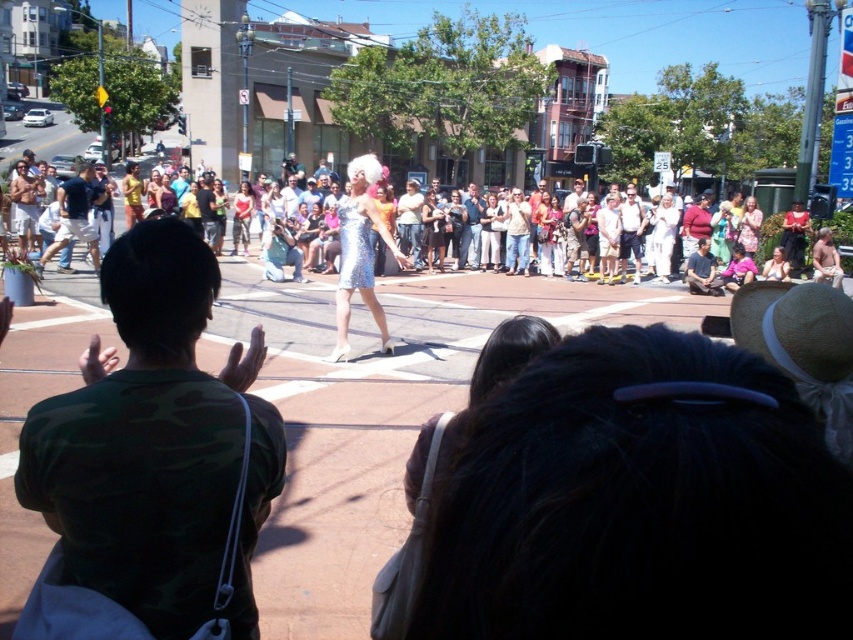
You are standing in the crowd watching the performer. Where is the camouflage shirt at center located in relation to the performer?

The camouflage shirt at center is located at point 0.697 on the x axis and 0.184 on the y axis relative to the performer.

You are standing in the crowd watching the parade. You want to get a better view of the shiny silver dress at center. The person in front of you is wearing matte blue jeans at left. Can you see the dress over their shoulder?

The shiny silver dress at center is behind matte blue jeans at left, so the person in front of you wearing matte blue jeans at left is blocking your view of the dress. You might need to move to the side to see it better.